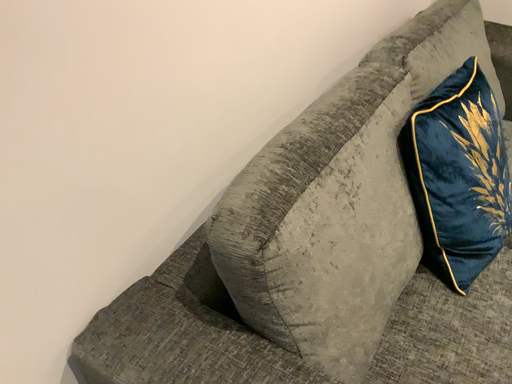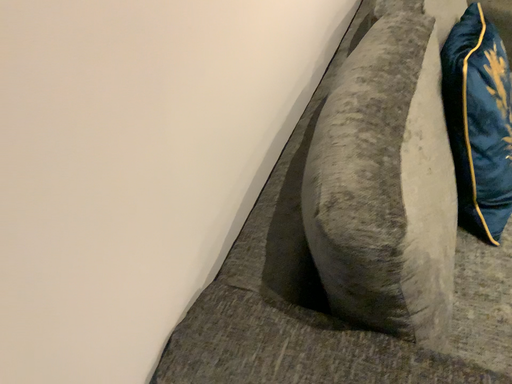
Question: How did the camera likely rotate when shooting the video?

Choices:
 (A) rotated right
 (B) rotated left

Answer: (A)